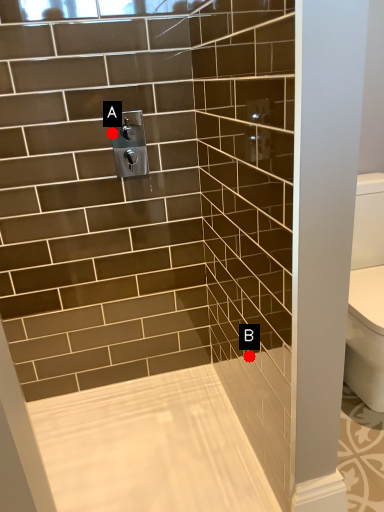
Question: Two points are circled on the image, labeled by A and B beside each circle. Which point appears closest to the camera in this image?

Choices:
 (A) A is closer
 (B) B is closer

Answer: (B)